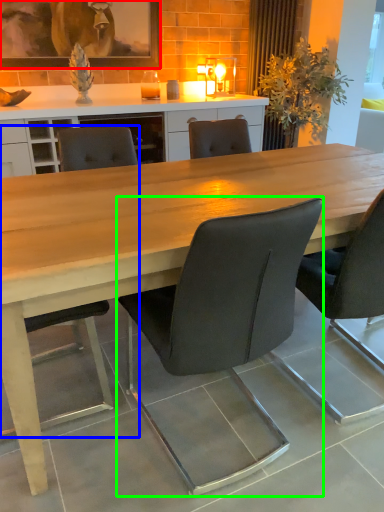
Question: Considering the real-world distances, which object is farthest from picture frame (highlighted by a red box)? chair (highlighted by a blue box) or chair (highlighted by a green box)?

Choices:
 (A) chair
 (B) chair

Answer: (B)